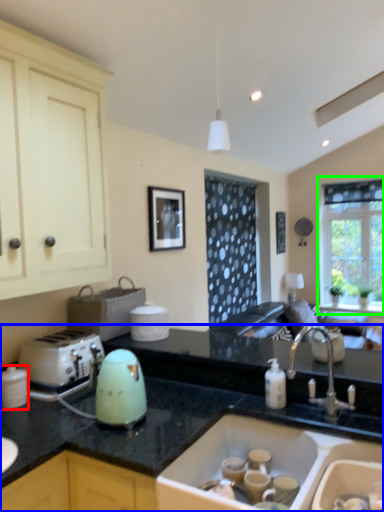
Question: Estimate the real-world distances between objects in this image. Which object is farther from kitchen appliance (highlighted by a red box), countertop (highlighted by a blue box) or window (highlighted by a green box)?

Choices:
 (A) countertop
 (B) window

Answer: (B)